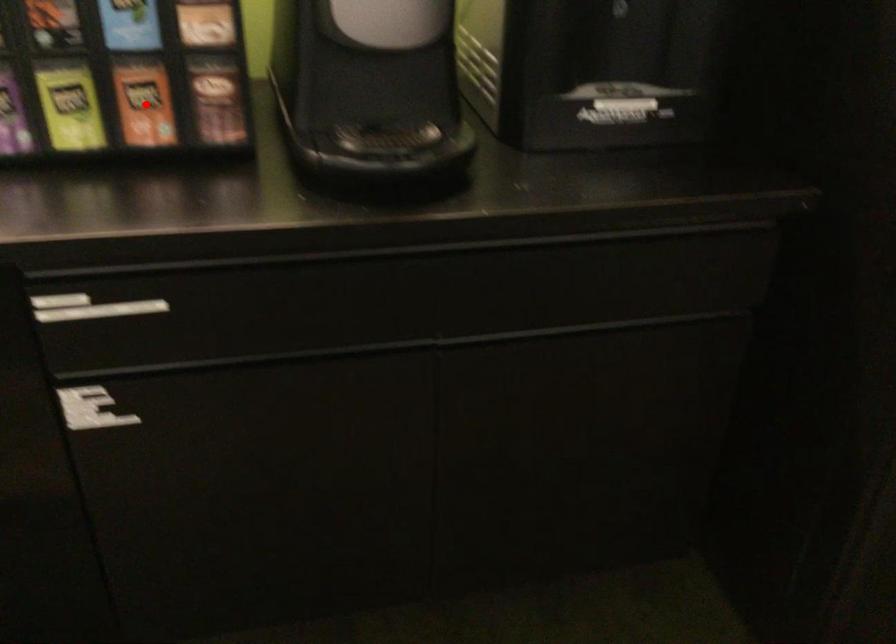
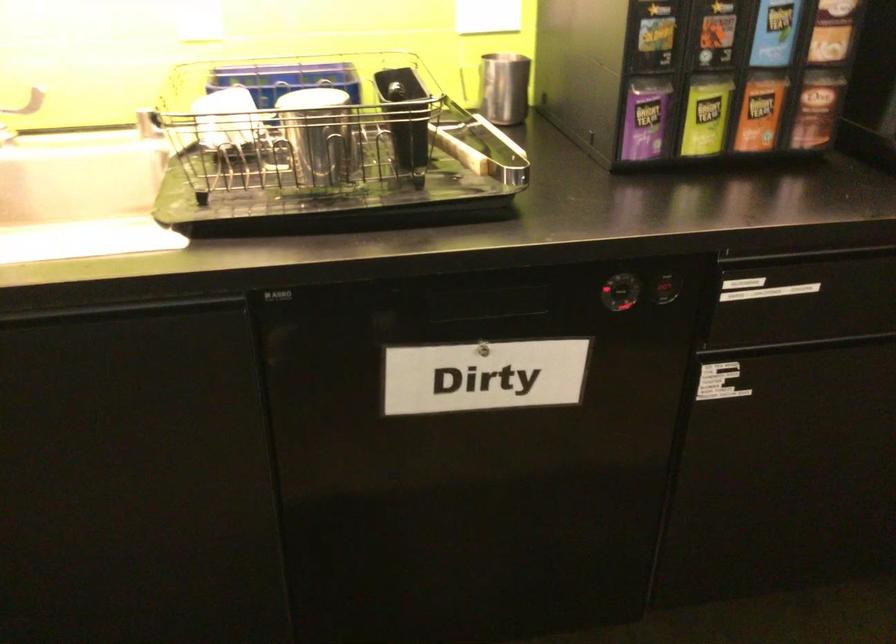
Where in the second image is the point corresponding to the highlighted location from the first image?

(760, 111)